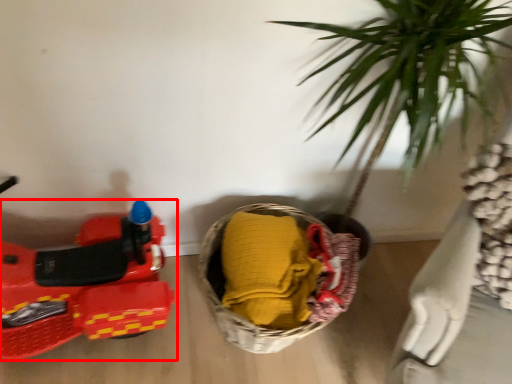
Question: Considering the relative positions of land vehicle (annotated by the red box) and basket in the image provided, where is land vehicle (annotated by the red box) located with respect to the staircase?

Choices:
 (A) left
 (B) right

Answer: (A)